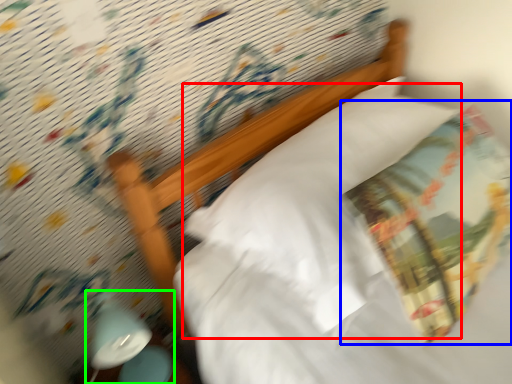
Question: Which object is the farthest from pillow (highlighted by a red box)? Choose among these: throw pillow (highlighted by a blue box) or bedside lamp (highlighted by a green box).

Choices:
 (A) throw pillow
 (B) bedside lamp

Answer: (B)